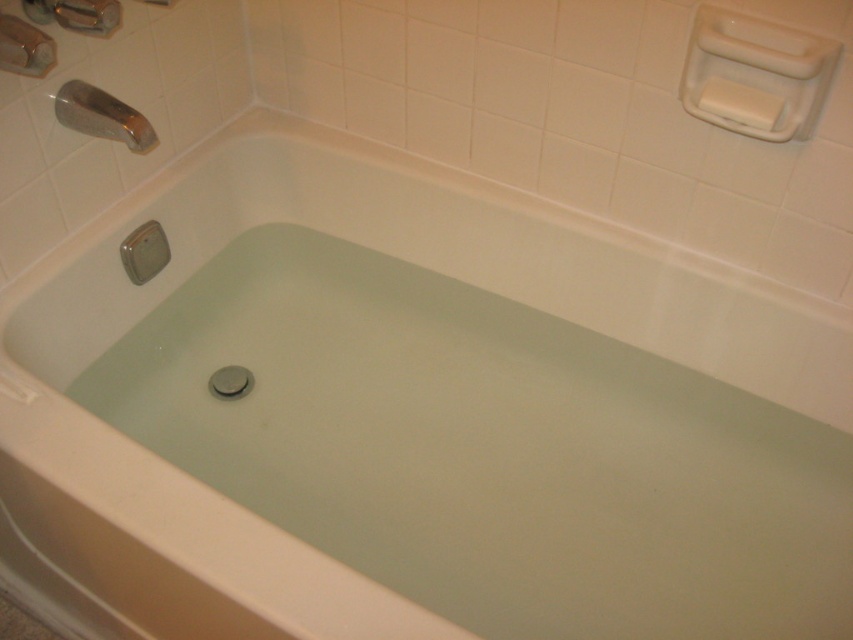
Question: Is the position of polished chrome faucet at upper left more distant than that of white matte soap at upper right?

Choices:
 (A) yes
 (B) no

Answer: (A)

Question: Is polished chrome faucet at upper left closer to the viewer compared to white matte soap at upper right?

Choices:
 (A) yes
 (B) no

Answer: (B)

Question: Which point is farther from the camera taking this photo?

Choices:
 (A) (126, 138)
 (B) (712, 104)

Answer: (A)

Question: Which point appears closest to the camera in this image?

Choices:
 (A) (735, 86)
 (B) (78, 122)

Answer: (A)

Question: Can you confirm if polished chrome faucet at upper left is wider than white matte soap at upper right?

Choices:
 (A) no
 (B) yes

Answer: (B)